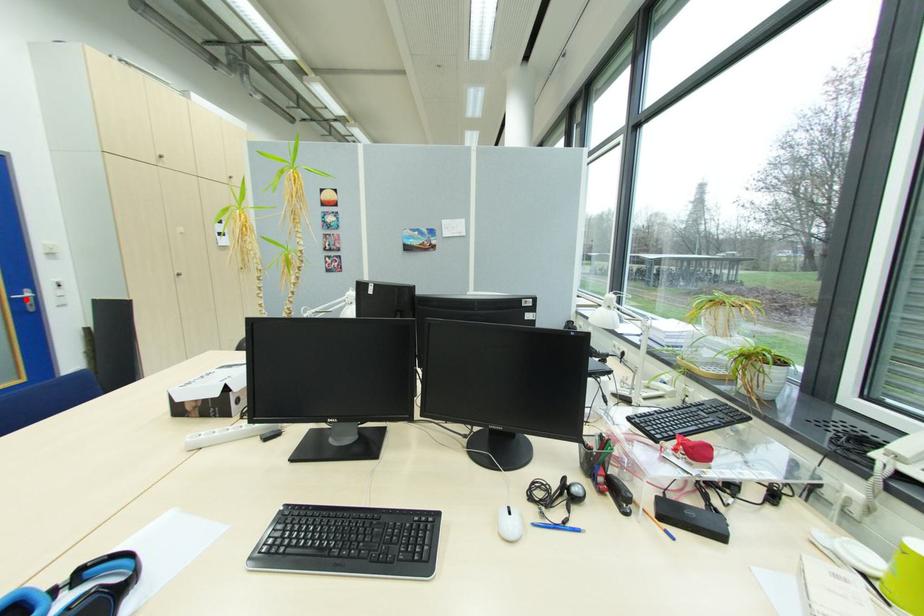
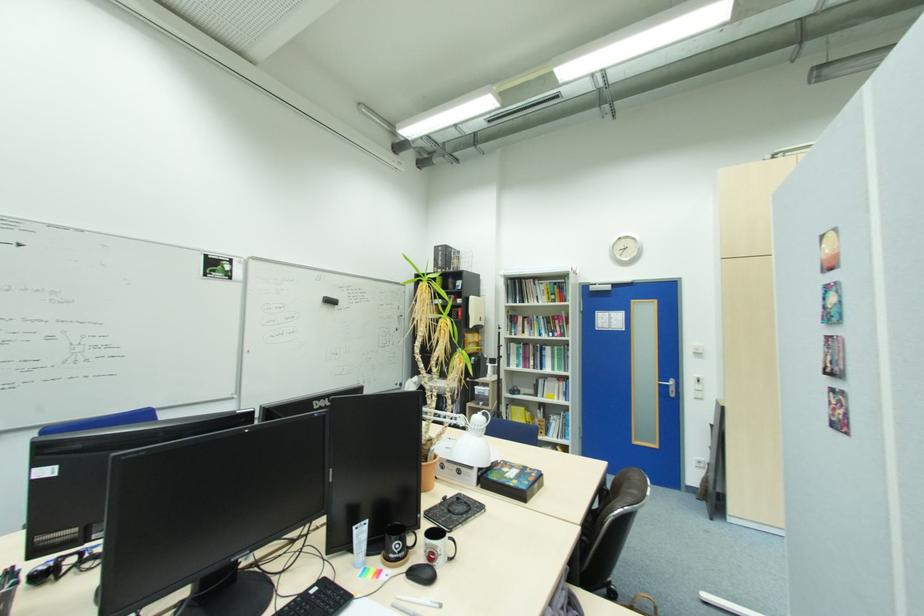
Locate, in the second image, the point that corresponds to the highlighted location in the first image.

(671, 386)